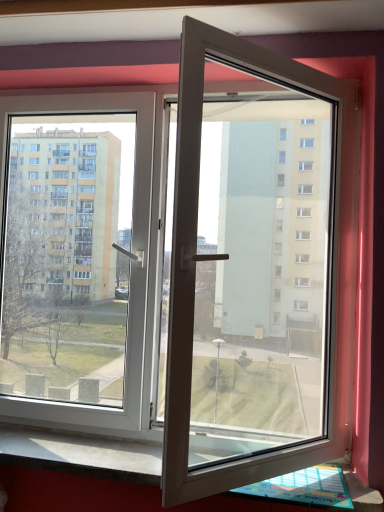
Question: Relative to black granite window sill at lower center, is white plastic door at center in front or behind?

Choices:
 (A) front
 (B) behind

Answer: (A)

Question: From a real-world perspective, is white plastic door at center positioned above or below black granite window sill at lower center?

Choices:
 (A) below
 (B) above

Answer: (B)

Question: Considering the positions of white plastic door at center and black granite window sill at lower center in the image, is white plastic door at center wider or thinner than black granite window sill at lower center?

Choices:
 (A) wide
 (B) thin

Answer: (A)

Question: From their relative heights in the image, would you say black granite window sill at lower center is taller or shorter than white plastic door at center?

Choices:
 (A) short
 (B) tall

Answer: (A)

Question: Considering the positions of black granite window sill at lower center and white plastic door at center in the image, is black granite window sill at lower center bigger or smaller than white plastic door at center?

Choices:
 (A) big
 (B) small

Answer: (B)

Question: Is black granite window sill at lower center inside or outside of white plastic door at center?

Choices:
 (A) outside
 (B) inside

Answer: (A)

Question: Visually, is black granite window sill at lower center positioned to the left or to the right of white plastic door at center?

Choices:
 (A) right
 (B) left

Answer: (A)